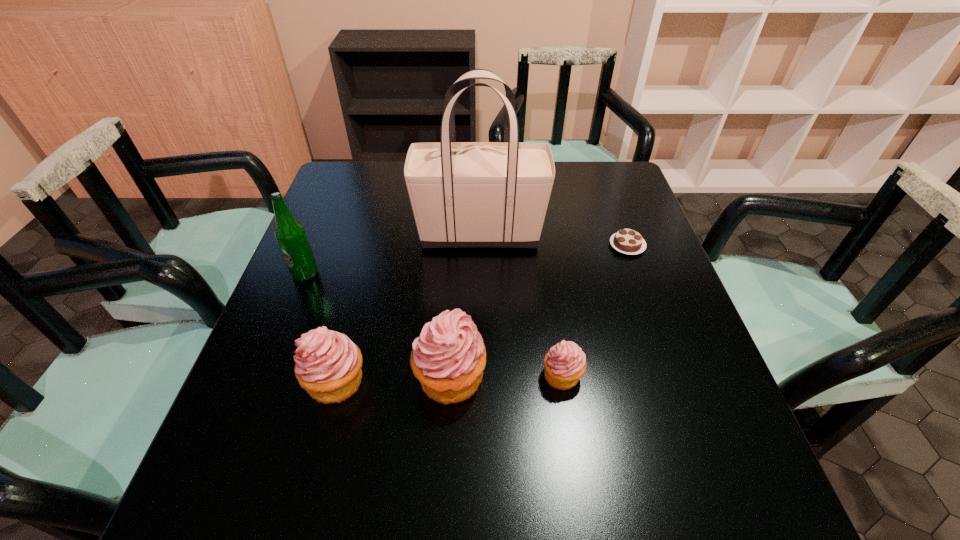
This screenshot has height=540, width=960. I want to click on the second tallest cupcake, so click(328, 365).

Where is `the leftmost cupcake`? The image size is (960, 540). the leftmost cupcake is located at coordinates (328, 365).

Locate an element on the screen. Image resolution: width=960 pixels, height=540 pixels. the second cupcake from left to right is located at coordinates (448, 358).

Locate an element on the screen. Image resolution: width=960 pixels, height=540 pixels. the rightmost cupcake is located at coordinates (565, 363).

The image size is (960, 540). Find the location of `the shortest cupcake`. the shortest cupcake is located at coordinates (565, 363).

Where is `shopping bag`? shopping bag is located at coordinates (463, 194).

Identify the location of the shortest object. (627, 241).

This screenshot has width=960, height=540. Identify the location of the rightmost object. (627, 241).

The width and height of the screenshot is (960, 540). What are the coordinates of `the third farthest object` in the screenshot? It's located at (290, 234).

The width and height of the screenshot is (960, 540). I want to click on the leftmost object, so click(x=290, y=234).